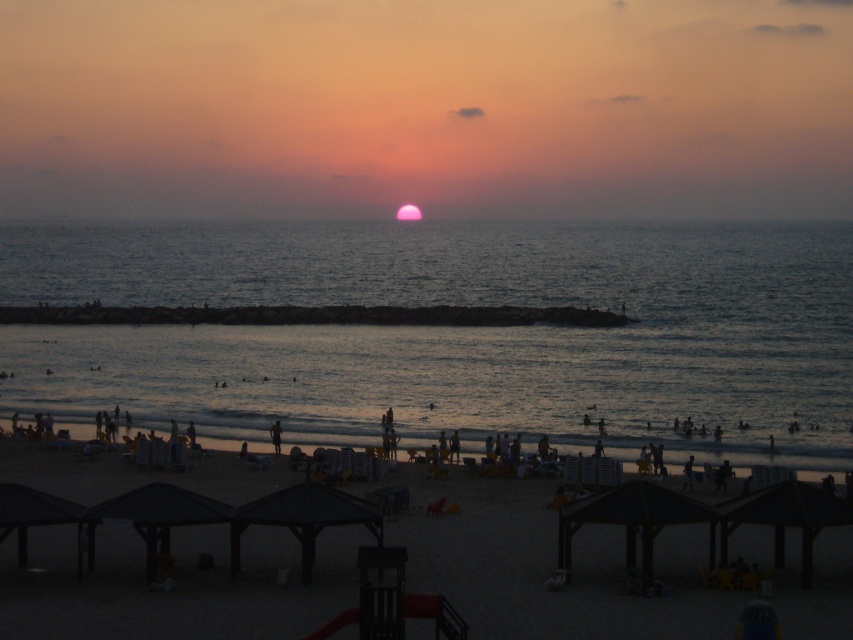
Question: Is dark wooden umbrellas at center closer to camera compared to dark skin person at lower center?

Choices:
 (A) yes
 (B) no

Answer: (A)

Question: Which object appears farthest from the camera in this image?

Choices:
 (A) dark skin person at lower center
 (B) blue water at center
 (C) dark wooden umbrellas at center

Answer: (B)

Question: Which object appears closest to the camera in this image?

Choices:
 (A) blue water at center
 (B) dark skin person at lower center
 (C) dark wooden umbrellas at center

Answer: (C)

Question: Which of the following is the closest to the observer?

Choices:
 (A) dark wooden umbrellas at center
 (B) blue water at center
 (C) dark skin person at lower center

Answer: (A)

Question: Does blue water at center have a larger size compared to dark skin person at lower center?

Choices:
 (A) yes
 (B) no

Answer: (A)

Question: Does dark wooden umbrellas at center appear under dark skin person at lower center?

Choices:
 (A) no
 (B) yes

Answer: (B)